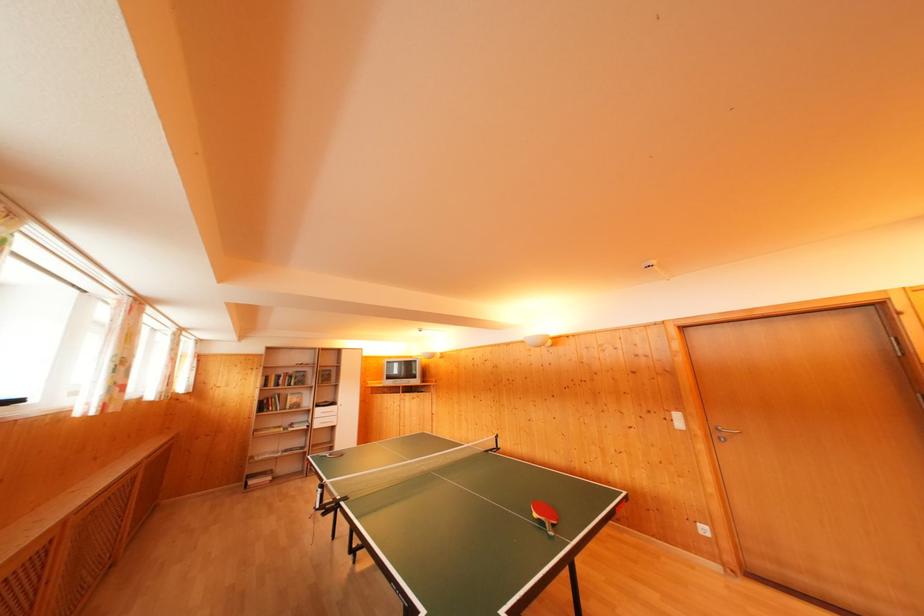
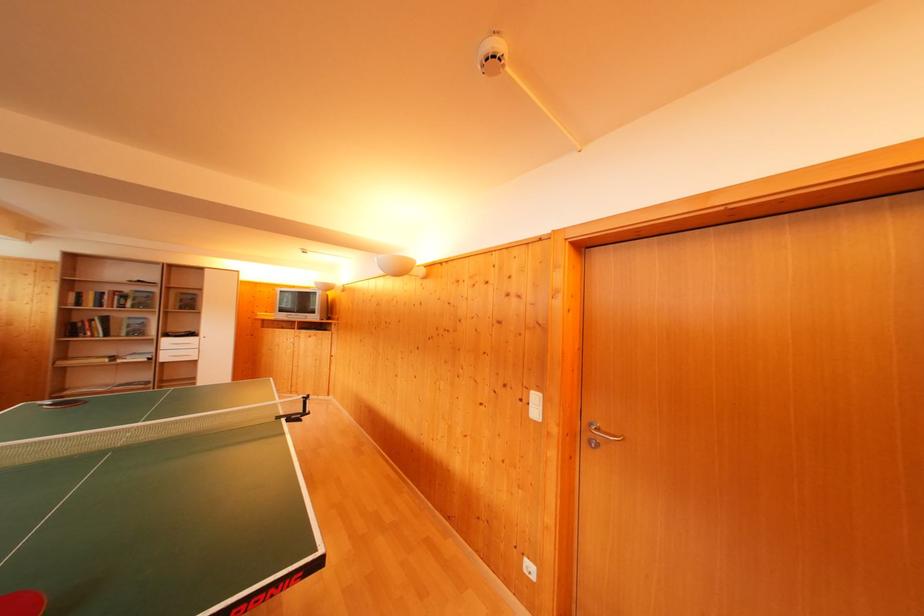
In the second image, find the point that corresponds to [286,377] in the first image.

(112, 294)